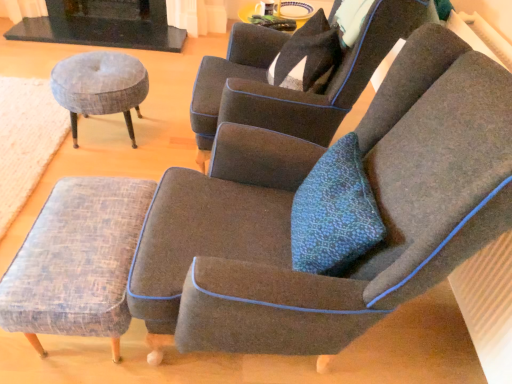
Question: Is black stone fireplace at upper left at the back of dark gray fabric chair at center, the 2th chair positioned from the back?

Choices:
 (A) yes
 (B) no

Answer: (B)

Question: Could you tell me if dark gray fabric chair at center, the 2th chair positioned from the back, is turned towards black stone fireplace at upper left?

Choices:
 (A) no
 (B) yes

Answer: (A)

Question: Is dark gray fabric chair at center, the 2th chair positioned from the back, thinner than black stone fireplace at upper left?

Choices:
 (A) no
 (B) yes

Answer: (A)

Question: Does dark gray fabric chair at center, acting as the first chair starting from the front, lie behind black stone fireplace at upper left?

Choices:
 (A) no
 (B) yes

Answer: (A)

Question: Does dark gray fabric chair at center, acting as the first chair starting from the front, have a greater height compared to black stone fireplace at upper left?

Choices:
 (A) no
 (B) yes

Answer: (B)

Question: Considering the relative sizes of dark gray fabric chair at center, the 2th chair positioned from the back, and black stone fireplace at upper left in the image provided, is dark gray fabric chair at center, the 2th chair positioned from the back, smaller than black stone fireplace at upper left?

Choices:
 (A) no
 (B) yes

Answer: (A)

Question: Is dark gray fabric chair at upper center, the 1th chair in the back-to-front sequence, positioned in front of woven fabric ottoman at lower left?

Choices:
 (A) no
 (B) yes

Answer: (B)

Question: From the image's perspective, is dark gray fabric chair at upper center, the 1th chair in the back-to-front sequence, on woven fabric ottoman at lower left?

Choices:
 (A) yes
 (B) no

Answer: (A)

Question: Is dark gray fabric chair at upper center, arranged as the 2th chair when viewed from the front, turned away from woven fabric ottoman at lower left?

Choices:
 (A) yes
 (B) no

Answer: (B)

Question: Is dark gray fabric chair at upper center, the 1th chair in the back-to-front sequence, positioned beyond the bounds of woven fabric ottoman at lower left?

Choices:
 (A) no
 (B) yes

Answer: (B)

Question: Can you confirm if dark gray fabric chair at upper center, arranged as the 2th chair when viewed from the front, is smaller than woven fabric ottoman at lower left?

Choices:
 (A) yes
 (B) no

Answer: (B)

Question: Is woven fabric ottoman at lower left wider than dark gray fabric chair at upper center, the 1th chair in the back-to-front sequence?

Choices:
 (A) yes
 (B) no

Answer: (A)